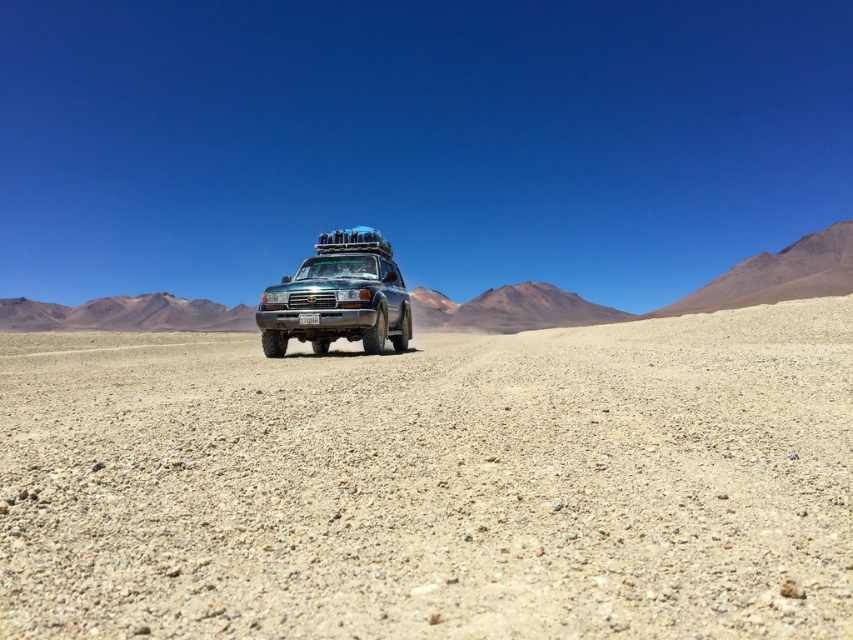
You are a driver of the green matte jeep at center. You need to cross a patch of light brown gravel at center. Can you safely drive over it without getting stuck?

The light brown gravel at center might be wider than green matte jeep at center, so it is possible to drive over it safely as the gravel patch is likely wide enough to accommodate the vehicle.

You are a passenger in the offroad vehicle and looking out the window. You see two points in the desert landscape. Which point is closer to the vehicle? The points are point at coordinate (489, 467) and point at coordinate (358, 288).

Point at coordinate (489, 467) is closer to the vehicle because it is closer to the viewer compared to point at coordinate (358, 288).